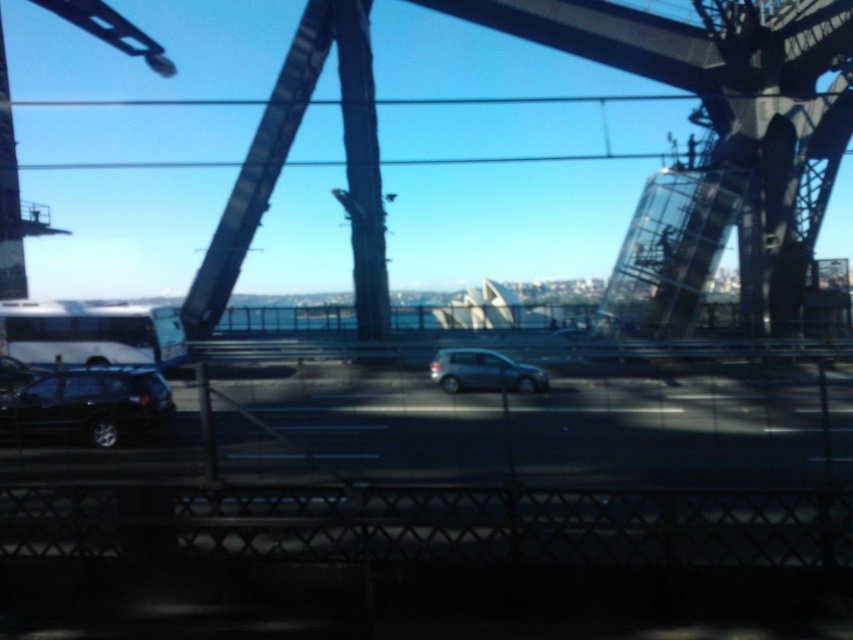
You are driving a car and want to know if there is enough space to pass the shiny black suv at lower left on the black metal bridge at center. Can you safely pass the suv using the bridge?

The black metal bridge at center is wider than the shiny black suv at lower left, so there should be enough space to safely pass the suv on the bridge.